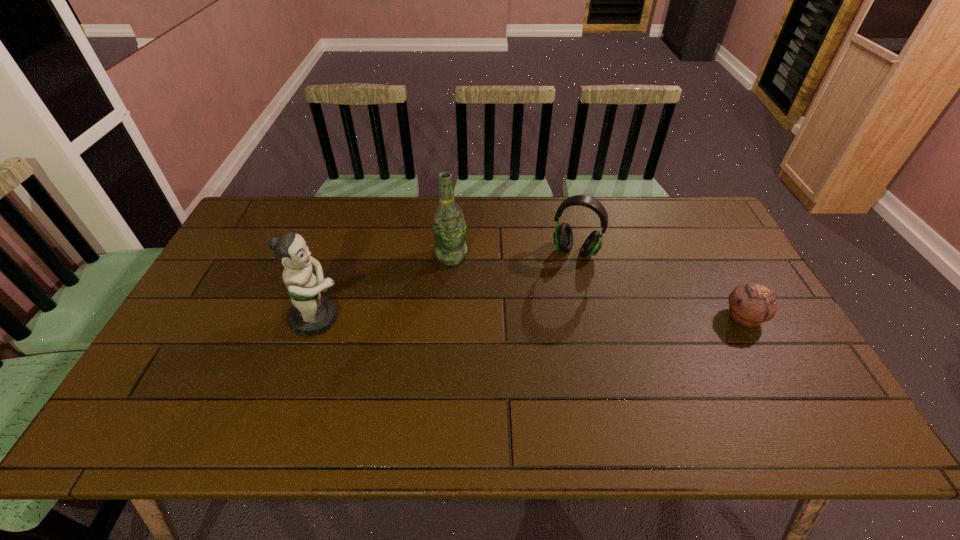
I want to click on free point between the muffin and the headset, so click(660, 285).

Where is `object that stands as the second closest to the figurine`? This screenshot has width=960, height=540. object that stands as the second closest to the figurine is located at coordinates (563, 237).

Locate an element on the screen. object that is the second closest to the muffin is located at coordinates (449, 229).

Identify the location of vacant area that satisfies the following two spatial constraints: 1. on the back side of the third object from left to right; 2. on the right side of the beer bottle. (451, 252).